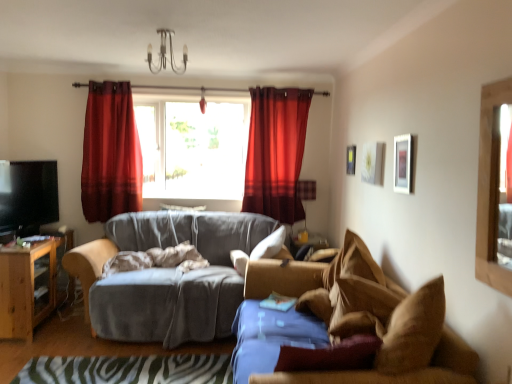
Question: From a real-world perspective, does black glossy tv at left stand above wooden cabinet at left?

Choices:
 (A) yes
 (B) no

Answer: (A)

Question: Does black glossy tv at left appear on the left side of wooden cabinet at left?

Choices:
 (A) yes
 (B) no

Answer: (B)

Question: Considering the relative sizes of black glossy tv at left and wooden cabinet at left in the image provided, is black glossy tv at left thinner than wooden cabinet at left?

Choices:
 (A) no
 (B) yes

Answer: (B)

Question: Can you confirm if black glossy tv at left is shorter than wooden cabinet at left?

Choices:
 (A) no
 (B) yes

Answer: (B)

Question: Considering the relative positions of black glossy tv at left and wooden cabinet at left in the image provided, is black glossy tv at left to the right of wooden cabinet at left from the viewer's perspective?

Choices:
 (A) no
 (B) yes

Answer: (B)

Question: From the image's perspective, is black glossy tv at left on wooden cabinet at left?

Choices:
 (A) yes
 (B) no

Answer: (A)

Question: Is white matte picture frame at upper center, which appears as the second picture frame when viewed from the front, positioned behind velvet red curtain at upper center, the 2th curtain viewed from the right?

Choices:
 (A) yes
 (B) no

Answer: (B)

Question: From the image's perspective, would you say white matte picture frame at upper center, which is the 2th picture frame from back to front, is shown under velvet red curtain at upper center, the 2th curtain viewed from the right?

Choices:
 (A) no
 (B) yes

Answer: (B)

Question: Is white matte picture frame at upper center, which appears as the second picture frame when viewed from the front, shorter than velvet red curtain at upper center, the 2th curtain viewed from the right?

Choices:
 (A) yes
 (B) no

Answer: (A)

Question: Is white matte picture frame at upper center, which appears as the second picture frame when viewed from the front, facing towards velvet red curtain at upper center, the 2th curtain viewed from the right?

Choices:
 (A) no
 (B) yes

Answer: (A)

Question: Is white matte picture frame at upper center, which is the 2th picture frame from back to front, thinner than velvet red curtain at upper center, the first curtain viewed from the left?

Choices:
 (A) no
 (B) yes

Answer: (B)

Question: Is white matte picture frame at upper center, which appears as the second picture frame when viewed from the front, completely or partially outside of velvet red curtain at upper center, the first curtain viewed from the left?

Choices:
 (A) no
 (B) yes

Answer: (B)

Question: Is the position of brown fabric couch at right, which appears as the second studio couch when viewed from the back, less distant than that of velvet red curtain at upper center, the first curtain viewed from the left?

Choices:
 (A) no
 (B) yes

Answer: (B)